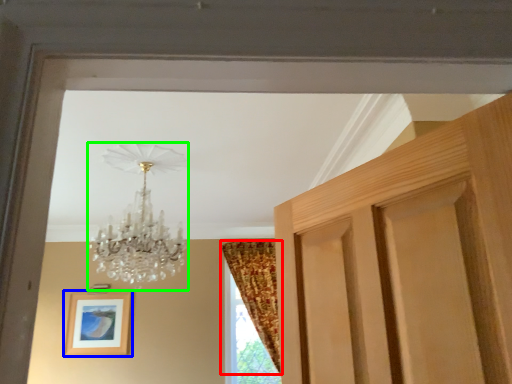
Question: Estimate the real-world distances between objects in this image. Which object is farther from curtain (highlighted by a red box), picture frame (highlighted by a blue box) or lamp (highlighted by a green box)?

Choices:
 (A) picture frame
 (B) lamp

Answer: (B)